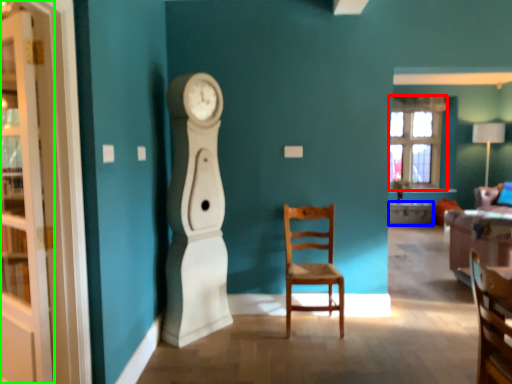
Question: Estimate the real-world distances between objects in this image. Which object is closer to window (highlighted by a red box), desk (highlighted by a blue box) or cabinetry (highlighted by a green box)?

Choices:
 (A) desk
 (B) cabinetry

Answer: (A)